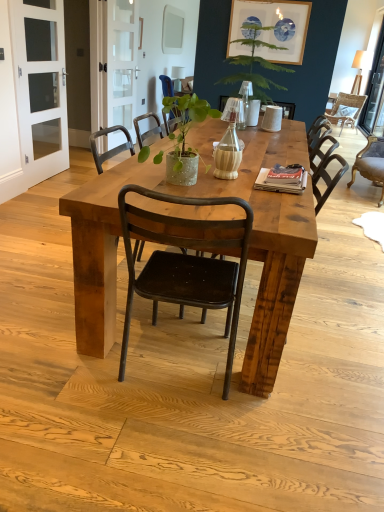
Locate an element on the screen. free space to the right of speckled concrete pot at center, placed as the 1th houseplant when sorted from bottom to top is located at coordinates (243, 195).